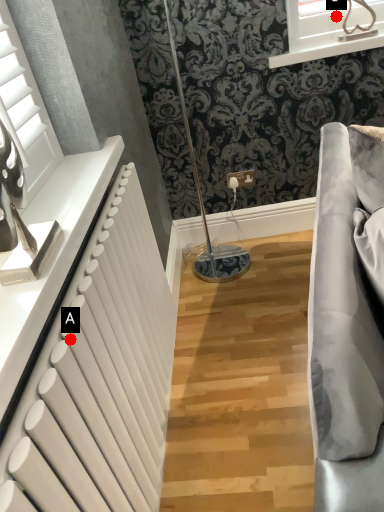
Question: Two points are circled on the image, labeled by A and B beside each circle. Among these points, which one is nearest to the camera?

Choices:
 (A) A is closer
 (B) B is closer

Answer: (A)